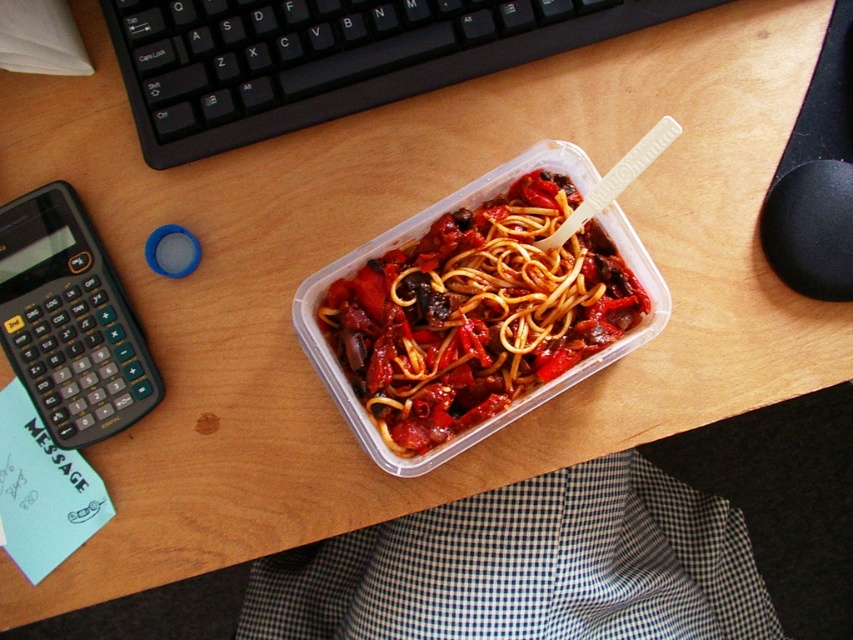
You need to place both the translucent plastic container at center and the black plastic calculator at left into a drawer that can only hold items smaller than the calculator. Can both items fit?

The translucent plastic container at center is larger in size than the black plastic calculator at left. Since the drawer can only hold items smaller than the calculator, the container cannot fit, but the calculator can. Therefore, only the black plastic calculator at left can be placed in the drawer.

You are organizing items on a desk and want to stack the black plastic keyboard at upper center on top of the translucent plastic container at center. Is this possible based on their sizes?

The black plastic keyboard at upper center has a lesser height compared to the translucent plastic container at center, so stacking them would not be possible since the keyboard is shorter and might not provide enough stability.